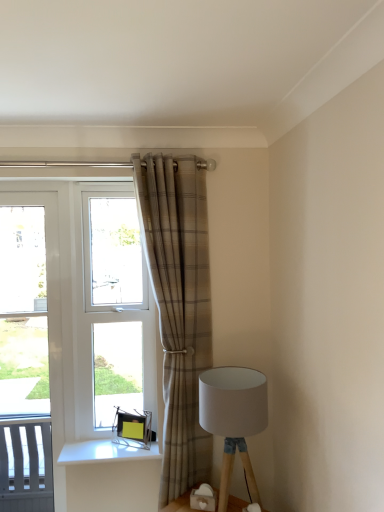
Question: From the image's perspective, is white fabric lampshade at lower right on white plastic screen door at left?

Choices:
 (A) no
 (B) yes

Answer: (A)

Question: Does white fabric lampshade at lower right appear on the left side of white plastic screen door at left?

Choices:
 (A) no
 (B) yes

Answer: (A)

Question: Considering the relative sizes of white fabric lampshade at lower right and white plastic screen door at left in the image provided, is white fabric lampshade at lower right wider than white plastic screen door at left?

Choices:
 (A) yes
 (B) no

Answer: (A)

Question: Is white fabric lampshade at lower right closer to the viewer compared to white plastic screen door at left?

Choices:
 (A) yes
 (B) no

Answer: (A)

Question: Could you tell me if white fabric lampshade at lower right is turned towards white plastic screen door at left?

Choices:
 (A) yes
 (B) no

Answer: (B)

Question: Considering the positions of plaid fabric curtain at center and white fabric lampshade at lower right in the image, is plaid fabric curtain at center bigger or smaller than white fabric lampshade at lower right?

Choices:
 (A) big
 (B) small

Answer: (A)

Question: From the image's perspective, is plaid fabric curtain at center located above or below white fabric lampshade at lower right?

Choices:
 (A) above
 (B) below

Answer: (A)

Question: Looking at their shapes, would you say plaid fabric curtain at center is wider or thinner than white fabric lampshade at lower right?

Choices:
 (A) thin
 (B) wide

Answer: (A)

Question: Is plaid fabric curtain at center inside or outside of white fabric lampshade at lower right?

Choices:
 (A) outside
 (B) inside

Answer: (A)

Question: Considering the positions of point (57, 434) and point (231, 470), is point (57, 434) closer or farther from the camera than point (231, 470)?

Choices:
 (A) closer
 (B) farther

Answer: (B)

Question: From their relative heights in the image, would you say white plastic screen door at left is taller or shorter than white fabric lampshade at lower right?

Choices:
 (A) tall
 (B) short

Answer: (A)

Question: In terms of width, does white plastic screen door at left look wider or thinner when compared to white fabric lampshade at lower right?

Choices:
 (A) thin
 (B) wide

Answer: (A)

Question: Would you say white plastic screen door at left is to the left or to the right of white fabric lampshade at lower right in the picture?

Choices:
 (A) left
 (B) right

Answer: (A)

Question: In terms of width, does clear glass window at center look wider or thinner when compared to white plastic screen door at left?

Choices:
 (A) wide
 (B) thin

Answer: (B)

Question: From the image's perspective, is clear glass window at center positioned above or below white plastic screen door at left?

Choices:
 (A) above
 (B) below

Answer: (A)